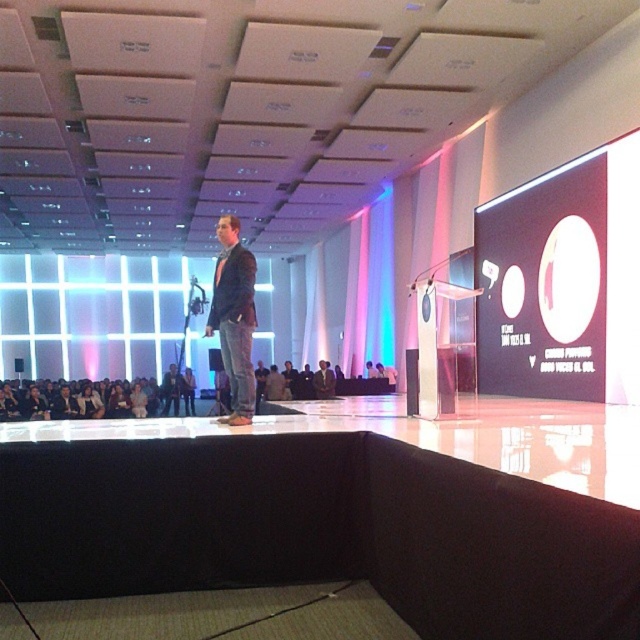
You are an event planner setting up for a presentation. You need to ensure that the matte black circle at upper right and the dark blue jeans at center are visible to the audience. Considering their sizes, which object might be more challenging to see from the back of the room?

The dark blue jeans at center might be harder to see from the back of the room because the matte black circle at upper right is taller than it.

You are seated in the audience and want to refer to the large screen during the presentation. Where exactly on the screen is the matte black circle at upper right located in terms of coordinates?

The matte black circle at upper right is located at point coordinates 0.441 on the x axis and 0.880 on the y axis.

You are an attendee at the presentation. You notice the matte black circle at upper right and the dark blue jeans at center. Which object is closer to the speaker?

The matte black circle at upper right is positioned over the dark blue jeans at center, meaning it is closer to the speaker.